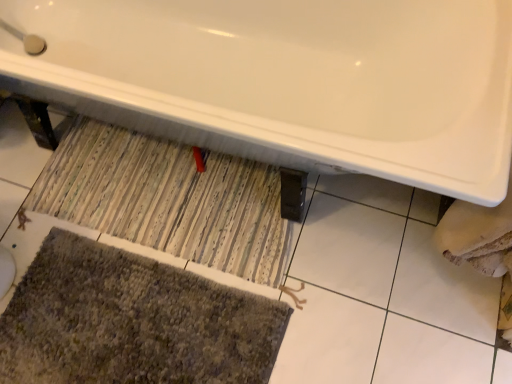
Question: Is white glossy bathtub at upper center looking in the opposite direction of striped fabric doormat at center?

Choices:
 (A) no
 (B) yes

Answer: (A)

Question: Is white glossy bathtub at upper center bigger than striped fabric doormat at center?

Choices:
 (A) yes
 (B) no

Answer: (A)

Question: Is white glossy bathtub at upper center aimed at striped fabric doormat at center?

Choices:
 (A) no
 (B) yes

Answer: (A)

Question: Is white glossy bathtub at upper center further to the viewer compared to striped fabric doormat at center?

Choices:
 (A) yes
 (B) no

Answer: (B)

Question: Does white glossy bathtub at upper center have a greater width compared to striped fabric doormat at center?

Choices:
 (A) yes
 (B) no

Answer: (A)

Question: From the image's perspective, is white glossy bathtub at upper center under striped fabric doormat at center?

Choices:
 (A) no
 (B) yes

Answer: (A)

Question: Does textured gray bath mat at lower left appear on the right side of white glossy bathtub at upper center?

Choices:
 (A) yes
 (B) no

Answer: (B)

Question: Is white glossy bathtub at upper center at the back of textured gray bath mat at lower left?

Choices:
 (A) yes
 (B) no

Answer: (B)

Question: Can we say textured gray bath mat at lower left lies outside white glossy bathtub at upper center?

Choices:
 (A) yes
 (B) no

Answer: (A)

Question: Would you consider textured gray bath mat at lower left to be distant from white glossy bathtub at upper center?

Choices:
 (A) yes
 (B) no

Answer: (B)

Question: From a real-world perspective, does textured gray bath mat at lower left sit lower than white glossy bathtub at upper center?

Choices:
 (A) yes
 (B) no

Answer: (A)

Question: Could you tell me if textured gray bath mat at lower left is facing white glossy bathtub at upper center?

Choices:
 (A) yes
 (B) no

Answer: (B)

Question: Does textured gray bath mat at lower left appear on the left side of striped fabric doormat at center?

Choices:
 (A) no
 (B) yes

Answer: (B)